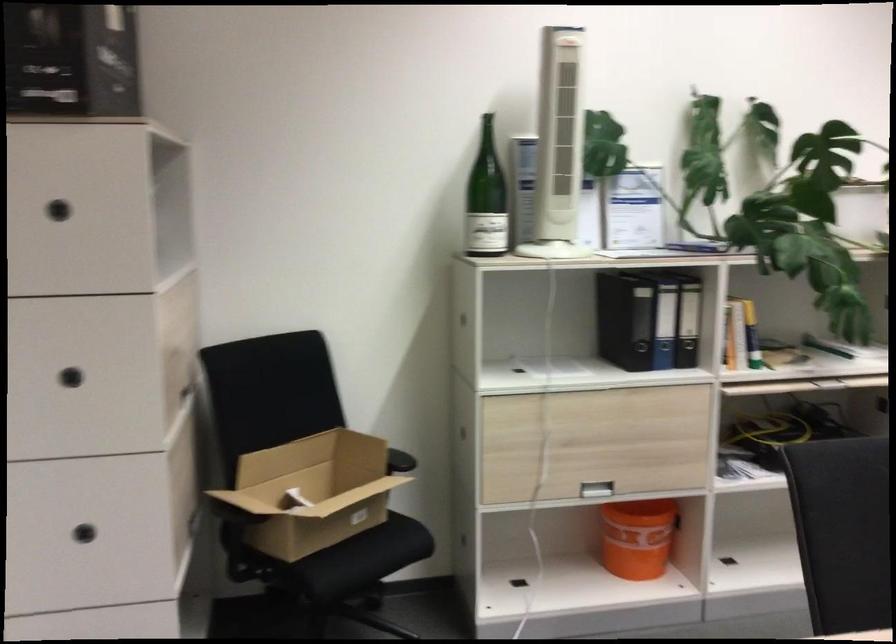
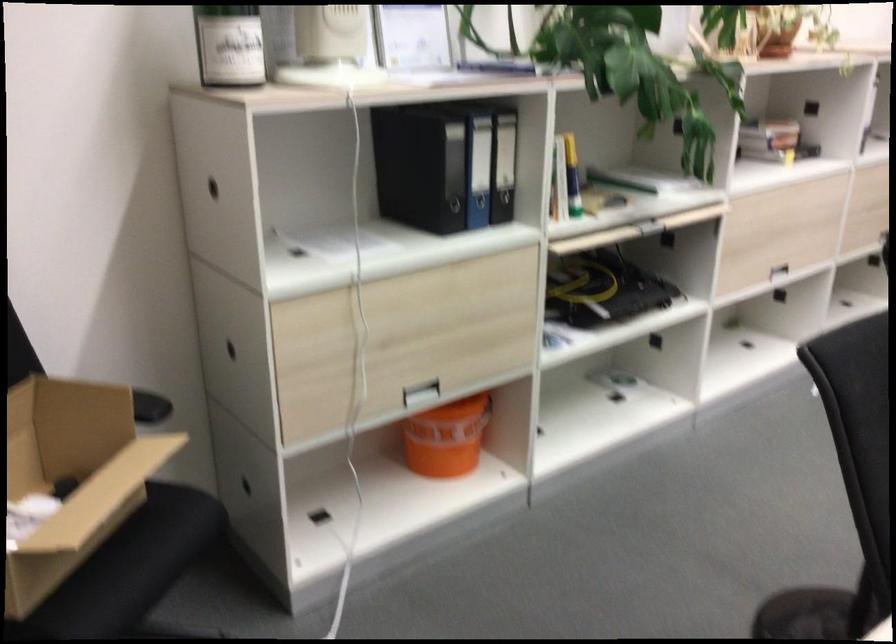
Locate, in the second image, the point that corresponds to pixel 595 486 in the first image.

(419, 393)